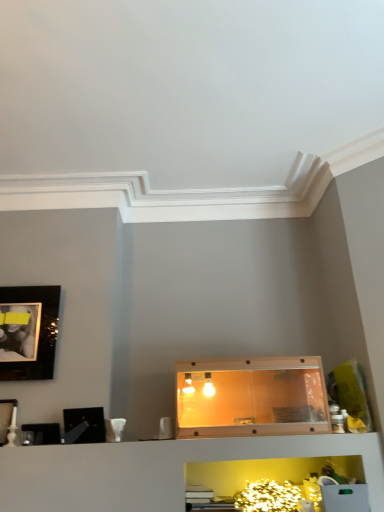
The height and width of the screenshot is (512, 384). What do you see at coordinates (88, 422) in the screenshot?
I see `black glossy picture frame at left, marked as the third picture frame in a bottom-to-top arrangement` at bounding box center [88, 422].

Measure the distance between matte black picture frame at lower left, marked as the 1th picture frame in a bottom-to-top arrangement, and camera.

matte black picture frame at lower left, marked as the 1th picture frame in a bottom-to-top arrangement, is 7.86 feet from camera.

Where is `black glossy picture frame at left, marked as the third picture frame in a bottom-to-top arrangement`? black glossy picture frame at left, marked as the third picture frame in a bottom-to-top arrangement is located at coordinates (88, 422).

In terms of height, does black glossy picture frame at left, the second picture frame from the top, look taller or shorter compared to matte black picture frame at lower left, marked as the 1th picture frame in a bottom-to-top arrangement?

In the image, black glossy picture frame at left, the second picture frame from the top, appears to be taller than matte black picture frame at lower left, marked as the 1th picture frame in a bottom-to-top arrangement.

Is the surface of black glossy picture frame at left, marked as the third picture frame in a bottom-to-top arrangement, in direct contact with matte black picture frame at lower left, marked as the 1th picture frame in a bottom-to-top arrangement?

No, black glossy picture frame at left, marked as the third picture frame in a bottom-to-top arrangement, is not beside matte black picture frame at lower left, marked as the 1th picture frame in a bottom-to-top arrangement.

How many degrees apart are the facing directions of black glossy picture frame at left, the second picture frame from the top, and matte black picture frame at lower left, the 4th picture frame when ordered from top to bottom?

18.5 degrees.

Find the location of a particular element. The width and height of the screenshot is (384, 512). the 4th picture frame counting from the left of the translucent plastic cabinet at center is located at coordinates (7, 419).

Considering the sizes of translucent plastic cabinet at center and matte black picture frame at left, placed as the 2th picture frame when sorted from bottom to top, in the image, is translucent plastic cabinet at center wider or thinner than matte black picture frame at left, placed as the 2th picture frame when sorted from bottom to top,?

Considering their sizes, translucent plastic cabinet at center looks broader than matte black picture frame at left, placed as the 2th picture frame when sorted from bottom to top.

Looking at this image, can we say translucent plastic cabinet at center lies outside matte black picture frame at left, which is counted as the 3th picture frame, starting from the top?

Indeed, translucent plastic cabinet at center is completely outside matte black picture frame at left, which is counted as the 3th picture frame, starting from the top.

From a real-world perspective, between translucent plastic cabinet at center and matte black picture frame at left, placed as the 2th picture frame when sorted from bottom to top, who is vertically lower?

matte black picture frame at left, placed as the 2th picture frame when sorted from bottom to top.

Is matte black picture frame at lower left, marked as the 1th picture frame in a bottom-to-top arrangement, wider or thinner than matte black picture frame at left, which is counted as the 3th picture frame, starting from the top?

Clearly, matte black picture frame at lower left, marked as the 1th picture frame in a bottom-to-top arrangement, has less width compared to matte black picture frame at left, which is counted as the 3th picture frame, starting from the top.

Is matte black picture frame at left, placed as the 2th picture frame when sorted from bottom to top, completely or partially inside matte black picture frame at lower left, the 4th picture frame when ordered from top to bottom?

No.

How many degrees apart are the facing directions of black glossy picture frame at left, the second picture frame from the top, and matte black picture frame at left, placed as the 2th picture frame when sorted from bottom to top?

There is a 18.4-degree angle between the facing directions of black glossy picture frame at left, the second picture frame from the top, and matte black picture frame at left, placed as the 2th picture frame when sorted from bottom to top.

Considering the sizes of black glossy picture frame at left, the second picture frame from the top, and matte black picture frame at left, placed as the 2th picture frame when sorted from bottom to top, in the image, is black glossy picture frame at left, the second picture frame from the top, taller or shorter than matte black picture frame at left, placed as the 2th picture frame when sorted from bottom to top,?

Considering their sizes, black glossy picture frame at left, the second picture frame from the top, has less height than matte black picture frame at left, placed as the 2th picture frame when sorted from bottom to top.

Is black glossy picture frame at left, the second picture frame from the top, wider or thinner than matte black picture frame at left, which is counted as the 3th picture frame, starting from the top?

Clearly, black glossy picture frame at left, the second picture frame from the top, has more width compared to matte black picture frame at left, which is counted as the 3th picture frame, starting from the top.

Considering the positions of objects black glossy picture frame at left, the second picture frame from the top, and matte black picture frame at left, placed as the 2th picture frame when sorted from bottom to top, in the image provided, who is in front, black glossy picture frame at left, the second picture frame from the top, or matte black picture frame at left, placed as the 2th picture frame when sorted from bottom to top,?

black glossy picture frame at left, the second picture frame from the top, is closer to the camera.

Is matte black picture frame at upper left, positioned as the 1th picture frame in top-to-bottom order, completely or partially inside matte black picture frame at lower left, marked as the 1th picture frame in a bottom-to-top arrangement?

That's incorrect, matte black picture frame at upper left, positioned as the 1th picture frame in top-to-bottom order, is not inside matte black picture frame at lower left, marked as the 1th picture frame in a bottom-to-top arrangement.

Does matte black picture frame at lower left, the 4th picture frame when ordered from top to bottom, have a smaller size compared to matte black picture frame at upper left, positioned as the 1th picture frame in top-to-bottom order?

Indeed, matte black picture frame at lower left, the 4th picture frame when ordered from top to bottom, has a smaller size compared to matte black picture frame at upper left, positioned as the 1th picture frame in top-to-bottom order.

Does matte black picture frame at lower left, the 4th picture frame when ordered from top to bottom, lie in front of matte black picture frame at upper left, marked as the 4th picture frame in a bottom-to-top arrangement?

Yes, it is.

From the image's perspective, which one is positioned lower, black glossy picture frame at left, marked as the third picture frame in a bottom-to-top arrangement, or translucent plastic cabinet at center?

From the image's view, black glossy picture frame at left, marked as the third picture frame in a bottom-to-top arrangement, is below.

Is black glossy picture frame at left, marked as the third picture frame in a bottom-to-top arrangement, completely or partially outside of translucent plastic cabinet at center?

Indeed, black glossy picture frame at left, marked as the third picture frame in a bottom-to-top arrangement, is completely outside translucent plastic cabinet at center.

In the scene shown: Who is more distant, black glossy picture frame at left, the second picture frame from the top, or translucent plastic cabinet at center?

translucent plastic cabinet at center is further away from the camera.

Is black glossy picture frame at left, marked as the third picture frame in a bottom-to-top arrangement, looking in the opposite direction of translucent plastic cabinet at center?

No, black glossy picture frame at left, marked as the third picture frame in a bottom-to-top arrangement, is not facing away from translucent plastic cabinet at center.

Is matte black picture frame at lower left, marked as the 1th picture frame in a bottom-to-top arrangement, touching black glossy picture frame at left, the second picture frame from the top?

No, matte black picture frame at lower left, marked as the 1th picture frame in a bottom-to-top arrangement, is not in contact with black glossy picture frame at left, the second picture frame from the top.

Is matte black picture frame at lower left, marked as the 1th picture frame in a bottom-to-top arrangement, turned away from black glossy picture frame at left, the second picture frame from the top?

No, matte black picture frame at lower left, marked as the 1th picture frame in a bottom-to-top arrangement, is not facing away from black glossy picture frame at left, the second picture frame from the top.

Where is `picture frame directly beneath the black glossy picture frame at left, the second picture frame from the top (from a real-world perspective)`? picture frame directly beneath the black glossy picture frame at left, the second picture frame from the top (from a real-world perspective) is located at coordinates (44, 433).

There is a matte black picture frame at lower left, marked as the 1th picture frame in a bottom-to-top arrangement. Identify the location of the 2nd picture frame above it (from the image's perspective). The height and width of the screenshot is (512, 384). (88, 422).

Find the location of `cabinetry that is above the matte black picture frame at left, which is counted as the 3th picture frame, starting from the top (from a real-world perspective)`. cabinetry that is above the matte black picture frame at left, which is counted as the 3th picture frame, starting from the top (from a real-world perspective) is located at coordinates [251, 397].

In the scene shown: From the image, which object appears to be nearer to translucent plastic cabinet at center, black glossy picture frame at left, the second picture frame from the top, or matte black picture frame at upper left, marked as the 4th picture frame in a bottom-to-top arrangement?

Based on the image, black glossy picture frame at left, the second picture frame from the top, appears to be nearer to translucent plastic cabinet at center.

Based on their spatial positions, is matte black picture frame at upper left, marked as the 4th picture frame in a bottom-to-top arrangement, or translucent plastic cabinet at center closer to matte black picture frame at lower left, the 4th picture frame when ordered from top to bottom?

Among the two, matte black picture frame at upper left, marked as the 4th picture frame in a bottom-to-top arrangement, is located nearer to matte black picture frame at lower left, the 4th picture frame when ordered from top to bottom.

Estimate the real-world distances between objects in this image. Which object is further from translucent plastic cabinet at center, black glossy picture frame at left, the second picture frame from the top, or matte black picture frame at left, which is counted as the 3th picture frame, starting from the top?

The object further to translucent plastic cabinet at center is matte black picture frame at left, which is counted as the 3th picture frame, starting from the top.

Estimate the real-world distances between objects in this image. Which object is closer to translucent plastic cabinet at center, matte black picture frame at left, placed as the 2th picture frame when sorted from bottom to top, or black glossy picture frame at left, the second picture frame from the top?

Based on the image, black glossy picture frame at left, the second picture frame from the top, appears to be nearer to translucent plastic cabinet at center.

Looking at the image, which one is located further to matte black picture frame at lower left, the 4th picture frame when ordered from top to bottom, matte black picture frame at left, placed as the 2th picture frame when sorted from bottom to top, or matte black picture frame at upper left, marked as the 4th picture frame in a bottom-to-top arrangement?

matte black picture frame at upper left, marked as the 4th picture frame in a bottom-to-top arrangement, lies further to matte black picture frame at lower left, the 4th picture frame when ordered from top to bottom, than the other object.

Based on their spatial positions, is matte black picture frame at left, which is counted as the 3th picture frame, starting from the top, or matte black picture frame at lower left, marked as the 1th picture frame in a bottom-to-top arrangement, closer to translucent plastic cabinet at center?

The object closer to translucent plastic cabinet at center is matte black picture frame at lower left, marked as the 1th picture frame in a bottom-to-top arrangement.

From the picture: From the image, which object appears to be nearer to matte black picture frame at left, placed as the 2th picture frame when sorted from bottom to top, matte black picture frame at lower left, marked as the 1th picture frame in a bottom-to-top arrangement, or black glossy picture frame at left, marked as the third picture frame in a bottom-to-top arrangement?

matte black picture frame at lower left, marked as the 1th picture frame in a bottom-to-top arrangement, lies closer to matte black picture frame at left, placed as the 2th picture frame when sorted from bottom to top, than the other object.

Which object lies further to the anchor point translucent plastic cabinet at center, matte black picture frame at lower left, the 4th picture frame when ordered from top to bottom, or matte black picture frame at upper left, positioned as the 1th picture frame in top-to-bottom order?

matte black picture frame at upper left, positioned as the 1th picture frame in top-to-bottom order, is further to translucent plastic cabinet at center.

Where is `picture frame between matte black picture frame at lower left, the 4th picture frame when ordered from top to bottom, and translucent plastic cabinet at center`? Image resolution: width=384 pixels, height=512 pixels. picture frame between matte black picture frame at lower left, the 4th picture frame when ordered from top to bottom, and translucent plastic cabinet at center is located at coordinates (88, 422).